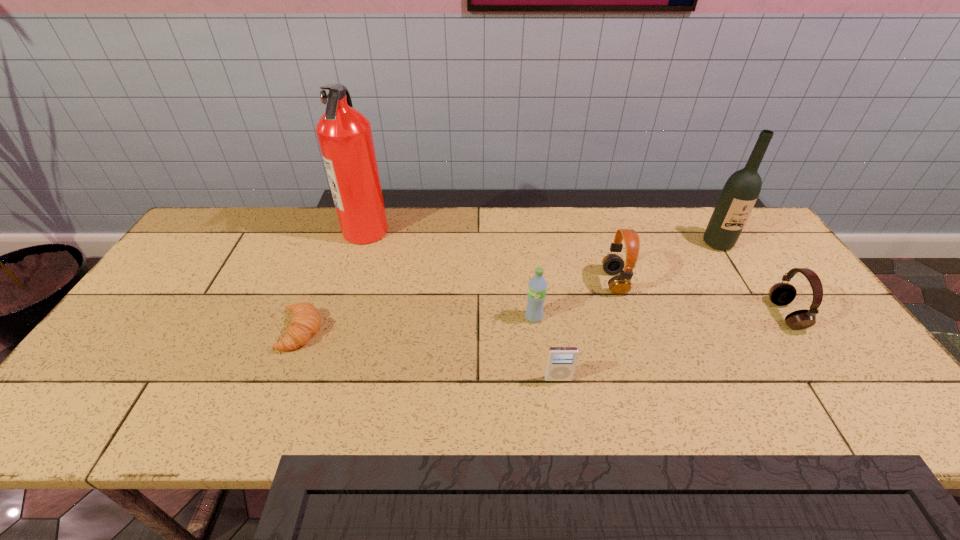
I want to click on vacant space located 0.400m on the right of the shortest object, so coord(479,331).

The width and height of the screenshot is (960, 540). Identify the location of fire extinguisher that is at the far edge. click(x=344, y=134).

Find the location of `wine bottle present at the far edge`. wine bottle present at the far edge is located at coordinates (740, 193).

I want to click on wine bottle situated at the right edge, so click(740, 193).

The image size is (960, 540). Identify the location of headset present at the right edge. (781, 294).

The width and height of the screenshot is (960, 540). In order to click on object that is at the far right corner in this screenshot , I will do `click(740, 193)`.

Identify the location of free space at the far edge of the desktop. Image resolution: width=960 pixels, height=540 pixels. (703, 242).

You are a GUI agent. You are given a task and a screenshot of the screen. Output one action in this format:
    pyautogui.click(x=<x>, y=<y>)
    Task: Click on the vacant space at the near edge of the desktop
    The width and height of the screenshot is (960, 540).
    Given the screenshot: What is the action you would take?
    pyautogui.click(x=443, y=408)

At what (x,y) coordinates should I click in order to perform the action: click on free space at the left edge of the desktop. Please return your answer as a coordinate pair (x, y). The height and width of the screenshot is (540, 960). Looking at the image, I should click on (181, 282).

What are the coordinates of `free space at the right edge` in the screenshot? It's located at (870, 369).